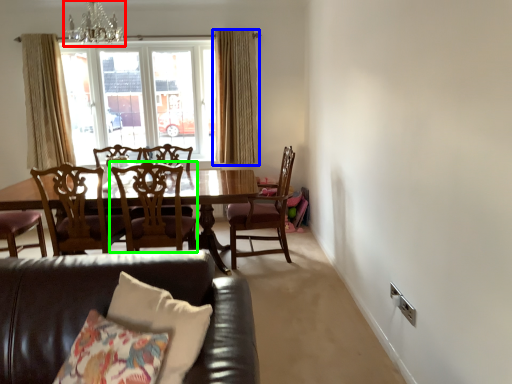
Question: Estimate the real-world distances between objects in this image. Which object is closer to chandelier (highlighted by a red box), curtain (highlighted by a blue box) or chair (highlighted by a green box)?

Choices:
 (A) curtain
 (B) chair

Answer: (A)